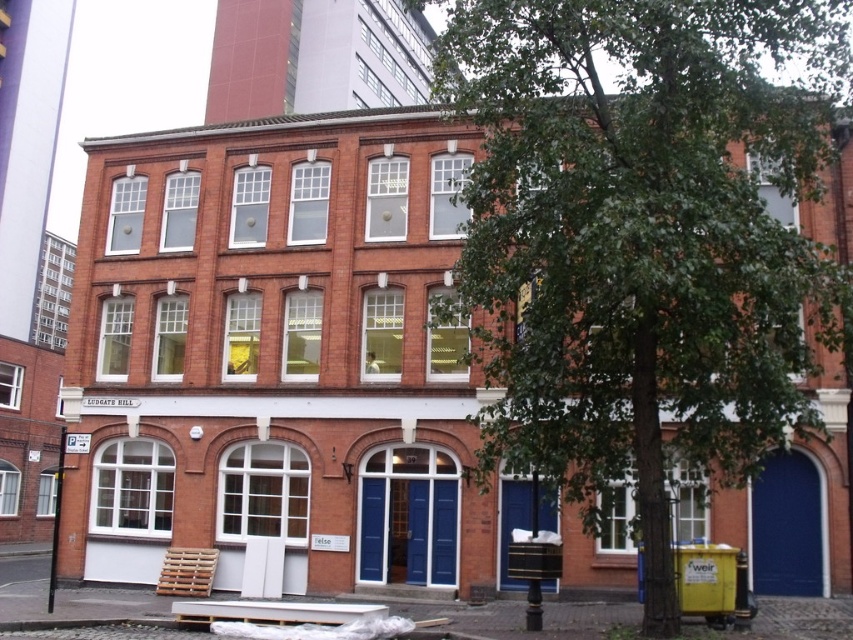
You are standing in front of the building and want to sit down. Which object, the metallic silver bench at lower center or the wooden pallet at lower left, is closer to you?

The metallic silver bench at lower center is closer to the viewer than the wooden pallet at lower left, so you should choose the metallic silver bench at lower center to sit down.

You are standing in front of the building and want to take a photo of the green leafy tree at center without the wooden pallet at lower left blocking the view. Is this possible?

The green leafy tree at center is in front of the wooden pallet at lower left, so you can take a photo of the green leafy tree at center without the wooden pallet at lower left blocking the view because the tree is closer to you than the pallet.

You are a visitor standing in front of the building and want to sit down. Which object between the green leafy tree at center and the metallic silver bench at lower center is more suitable for sitting?

The metallic silver bench at lower center is more suitable for sitting because the green leafy tree at center is bigger, but benches are designed for seating while trees are not typically used for sitting.